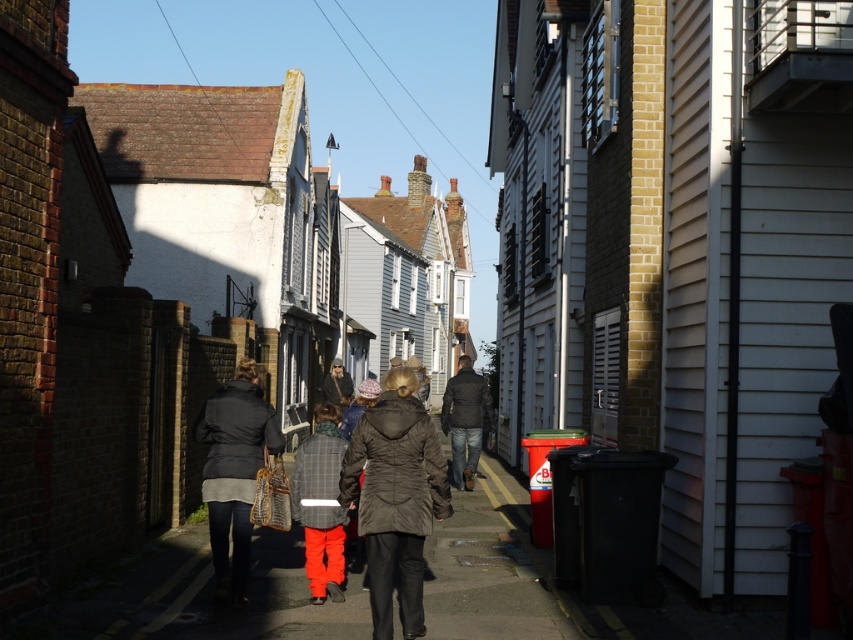
Question: Among these points, which one is farthest from the camera?

Choices:
 (A) (363, 500)
 (B) (257, 442)

Answer: (B)

Question: Is dark brown textured coat at center smaller than matte black jacket at center?

Choices:
 (A) no
 (B) yes

Answer: (A)

Question: Which point appears farthest from the camera in this image?

Choices:
 (A) (374, 552)
 (B) (206, 419)

Answer: (B)

Question: Can you confirm if dark brown textured coat at center is positioned to the right of matte black jacket at center?

Choices:
 (A) yes
 (B) no

Answer: (A)

Question: Is dark brown textured coat at center positioned in front of matte black jacket at center?

Choices:
 (A) yes
 (B) no

Answer: (A)

Question: Which of the following is the farthest from the observer?

Choices:
 (A) matte black jacket at center
 (B) dark brown textured coat at center

Answer: (A)